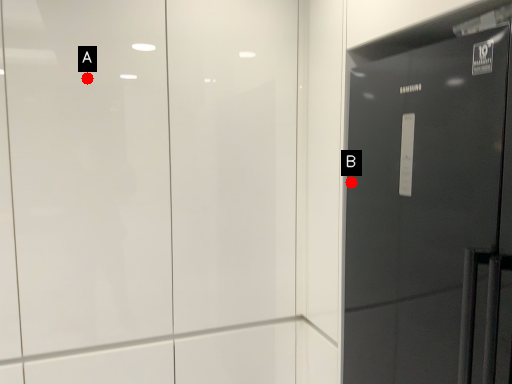
Question: Two points are circled on the image, labeled by A and B beside each circle. Among these points, which one is nearest to the camera?

Choices:
 (A) A is closer
 (B) B is closer

Answer: (A)